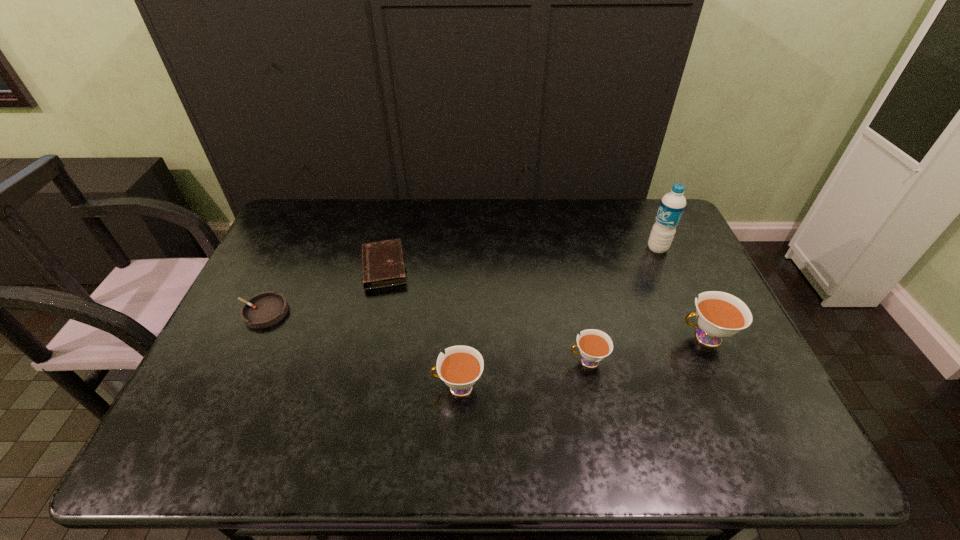
The width and height of the screenshot is (960, 540). In order to click on vacant space at the right edge of the desktop in this screenshot , I will do `click(669, 307)`.

Locate an element on the screen. vacant space at the far left corner of the desktop is located at coordinates (328, 219).

Find the location of a particular element. This screenshot has width=960, height=540. free spot between the third tallest object and the diary is located at coordinates (420, 327).

What are the coordinates of `vacant area that lies between the rightmost teacup and the tallest object` in the screenshot? It's located at (682, 293).

The image size is (960, 540). I want to click on vacant point located between the third tallest object and the diary, so click(x=420, y=327).

Find the location of `free space between the tallest teacup and the fifth object from right to left`. free space between the tallest teacup and the fifth object from right to left is located at coordinates (544, 302).

Identify the location of unoccupied position between the second object from left to right and the fourth tallest object. (486, 314).

Locate an element on the screen. This screenshot has width=960, height=540. empty space between the third object from right to left and the fourth object from right to left is located at coordinates (523, 374).

Identify the location of vacant area that lies between the tallest object and the second object from left to right. (520, 258).

Identify the location of blank region between the leftmost object and the fourth tallest object. This screenshot has height=540, width=960. (425, 336).